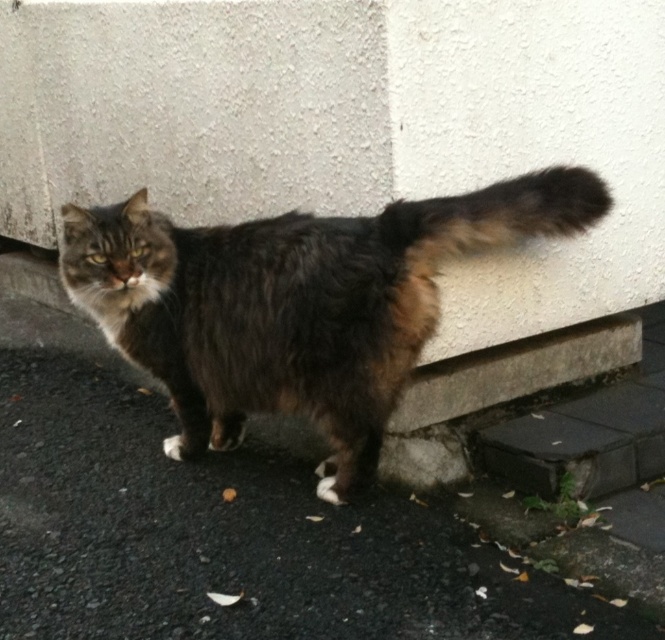
You are a photographer holding a camera at eye level. You want to capture a photo of the cat while ensuring both the dark asphalt pavement at lower center and the fuzzy brown tail at upper right are in focus. Given that your camera can only focus on objects within a 100 cm range, will both objects be in focus?

The distance between the dark asphalt pavement at lower center and the fuzzy brown tail at upper right is 88.18 centimeters, which is within the 100 cm range of the camera. Therefore, both objects will be in focus.

You are a delivery robot navigating to a location marked by a point on the image. The point is at coordinates point (231,538). According to the scene, where is this point located?

The point (231,538) is located on the dark asphalt pavement at lower center.